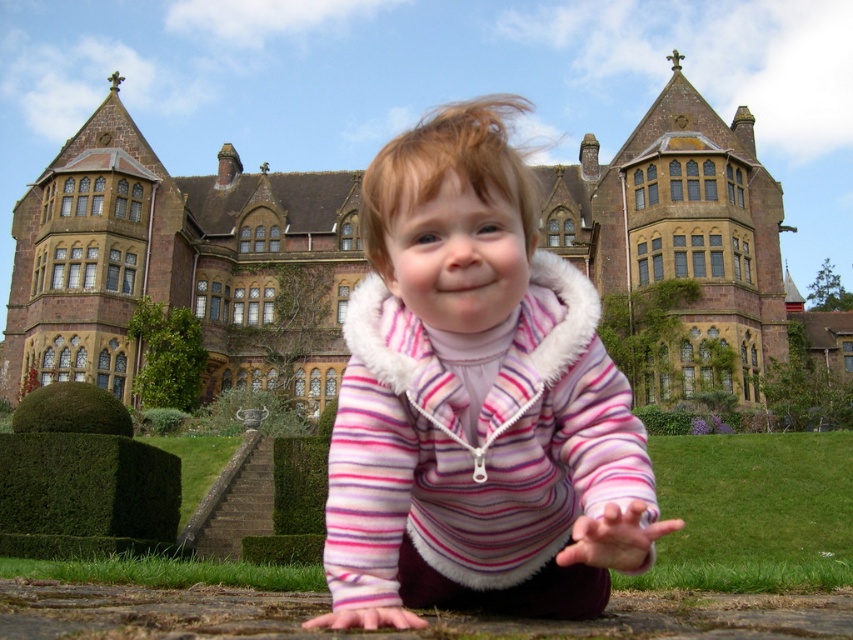
Who is more forward, (373, 561) or (329, 308)?

Point (373, 561) is more forward.

Is point (572, 499) in front of point (131, 177)?

Yes.

Identify the location of pink striped fleece at center. (474, 401).